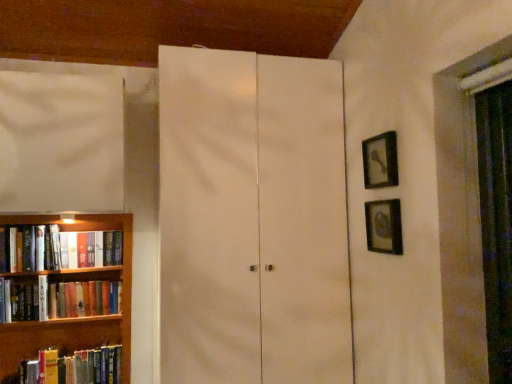
Question: In the image, is hardcover book at left, which is the second book in top-to-bottom order, on the left side or the right side of metallic silver picture frame at right, which ranks as the first picture frame in bottom-to-top order?

Choices:
 (A) left
 (B) right

Answer: (A)

Question: From the image's perspective, is hardcover book at left, the second book when ordered from bottom to top, positioned above or below metallic silver picture frame at right, the 2th picture frame in the top-to-bottom sequence?

Choices:
 (A) below
 (B) above

Answer: (A)

Question: Which is farther from the hardcover book at left, the third book viewed from the top?

Choices:
 (A) black matte picture frame at upper right, which ranks as the second picture frame in bottom-to-top order
 (B) white matte cabinet at center
 (C) wooden bookshelf at left
 (D) metallic silver picture frame at right, the 2th picture frame in the top-to-bottom sequence
 (E) hardcover book at left, positioned as the 3th book in bottom-to-top order

Answer: (A)

Question: Based on their relative distances, which object is farther from the hardcover book at left, positioned as the 3th book in bottom-to-top order?

Choices:
 (A) hardcover book at left, the third book viewed from the top
 (B) metallic silver picture frame at right, which ranks as the first picture frame in bottom-to-top order
 (C) wooden bookshelf at left
 (D) hardcover book at left, which is the second book in top-to-bottom order
 (E) white matte cabinet at center

Answer: (B)